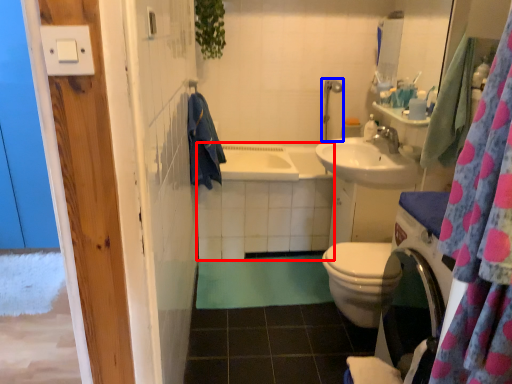
Question: Which object appears farthest to the camera in this image, bath (highlighted by a red box) or shower (highlighted by a blue box)?

Choices:
 (A) bath
 (B) shower

Answer: (B)